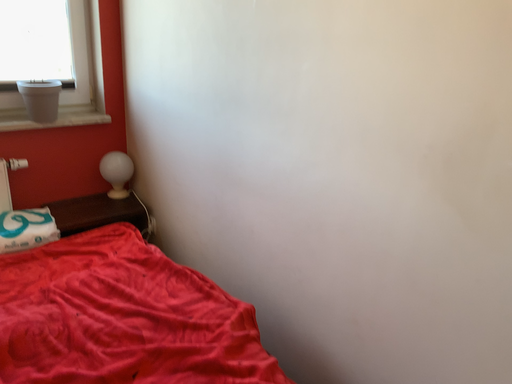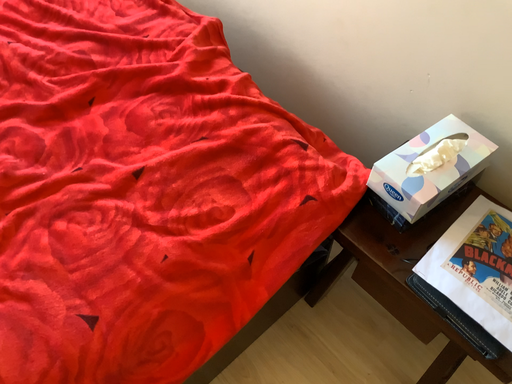
Question: Which way did the camera rotate in the video?

Choices:
 (A) rotated upward
 (B) rotated downward

Answer: (B)